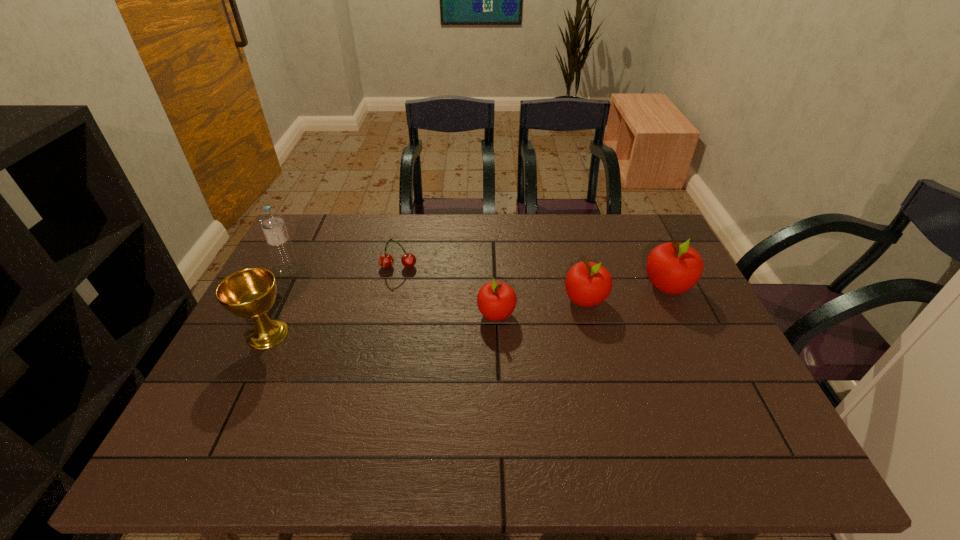
This screenshot has width=960, height=540. I want to click on free space between the fourth object from left to right and the fifth object from left to right, so click(x=540, y=307).

This screenshot has width=960, height=540. I want to click on vacant area that lies between the tallest object and the third object from right to left, so click(393, 293).

Locate an element on the screen. This screenshot has width=960, height=540. vacant space that is in between the chalice and the rightmost object is located at coordinates [468, 310].

Choose which object is the second nearest neighbor to the shortest apple. Please provide its 2D coordinates. Your answer should be formatted as a tuple, i.e. [(x, y)], where the tuple contains the x and y coordinates of a point satisfying the conditions above.

[(386, 260)]

Image resolution: width=960 pixels, height=540 pixels. I want to click on the closest object relative to the third object from left to right, so click(496, 300).

Select which apple appears as the closest to the shortest apple. Please provide its 2D coordinates. Your answer should be formatted as a tuple, i.e. [(x, y)], where the tuple contains the x and y coordinates of a point satisfying the conditions above.

[(587, 284)]

Locate an element on the screen. Image resolution: width=960 pixels, height=540 pixels. apple that is the second closest to the chalice is located at coordinates (587, 284).